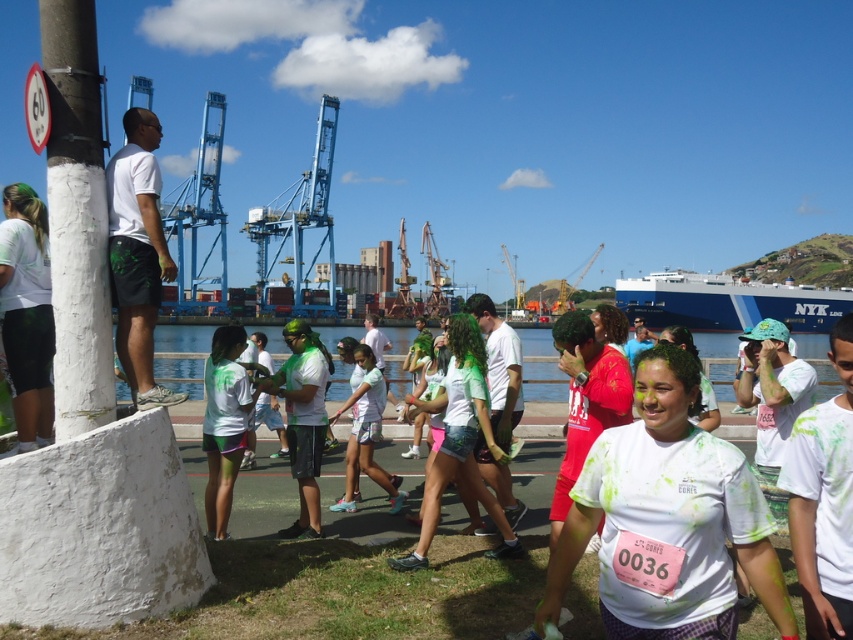
Can you confirm if white matte shirt at center is thinner than white matte shorts at left?

Incorrect, white matte shirt at center's width is not less than white matte shorts at left's.

Who is shorter, white matte shirt at center or white matte shorts at left?

Standing shorter between the two is white matte shirt at center.

Is point (660, 522) positioned before point (24, 445)?

Yes, point (660, 522) is closer to viewer.

Find the location of a particular element. This screenshot has height=640, width=853. white matte shirt at center is located at coordinates (668, 518).

Who is more distant from viewer, (838,314) or (376,376)?

The point (838,314) is behind.

Which is in front, point (697, 275) or point (335, 410)?

Point (335, 410) is in front.

Is point (709, 276) more distant than point (350, 488)?

That is True.

The height and width of the screenshot is (640, 853). In order to click on blue matte container ship at center in this screenshot , I will do `click(728, 301)`.

Can you confirm if white textured pole at left is smaller than matte green shirt at center?

Indeed, white textured pole at left has a smaller size compared to matte green shirt at center.

Between white textured pole at left and matte green shirt at center, which one has less height?

Standing shorter between the two is matte green shirt at center.

Is point (90, 13) less distant than point (219, 461)?

Yes, point (90, 13) is in front of point (219, 461).

Locate an element on the screen. This screenshot has height=640, width=853. white textured pole at left is located at coordinates (76, 220).